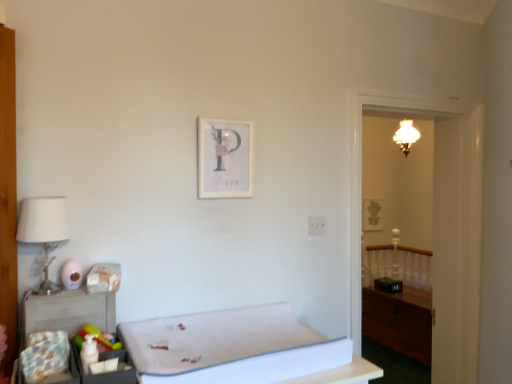
You are a GUI agent. You are given a task and a screenshot of the screen. Output one action in this format:
    pyautogui.click(x=<x>, y=<y>)
    Task: Click on the vacant space underneath white fabric lampshade at left (from a real-world perspective)
    
    Given the screenshot: What is the action you would take?
    pyautogui.click(x=47, y=288)